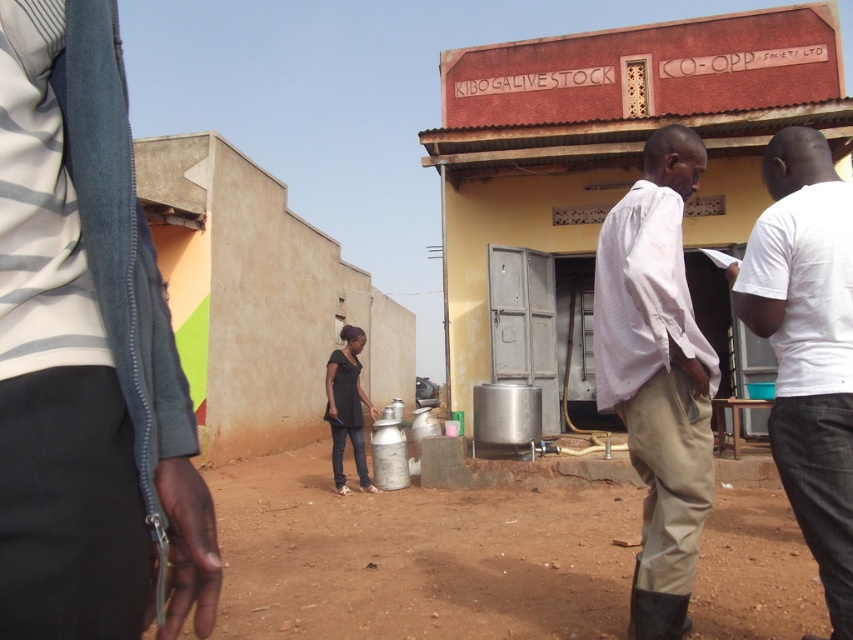
You are standing in the rural scene described. You need to walk from the brown dirt field at center to the white cotton shirt at right. Which direction should you move relative to the field?

You should move to the right relative to the brown dirt field at center because the white cotton shirt at right is positioned on the right side of the field.

You are a delivery person who needs to place a large package on the ground between the metallic silver tank at center and the black matte dress at center. Which object should you move to make space?

The metallic silver tank at center is larger in size than the black matte dress at center. Since the tank is bigger, it might be harder to move. Therefore, you should move the black matte dress at center to create space for the package.